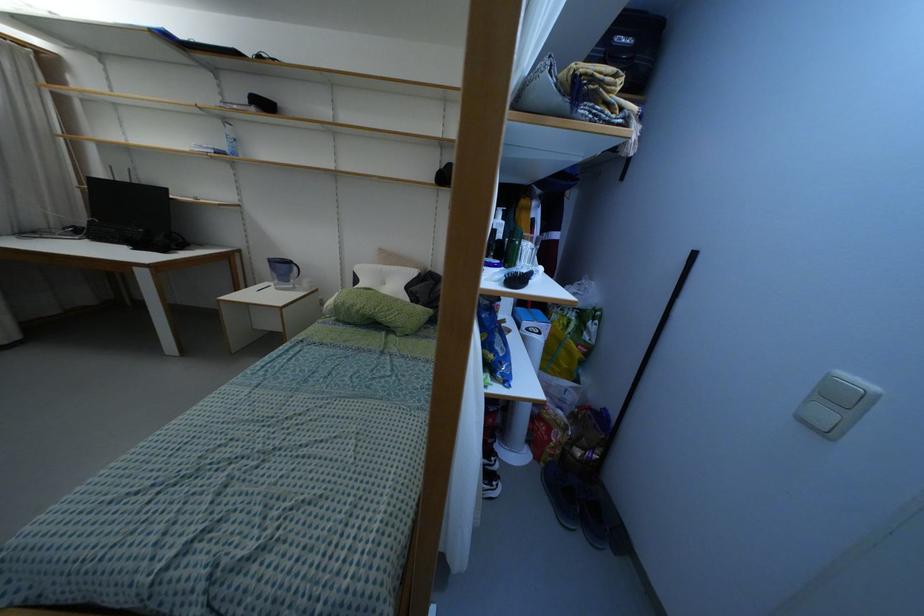
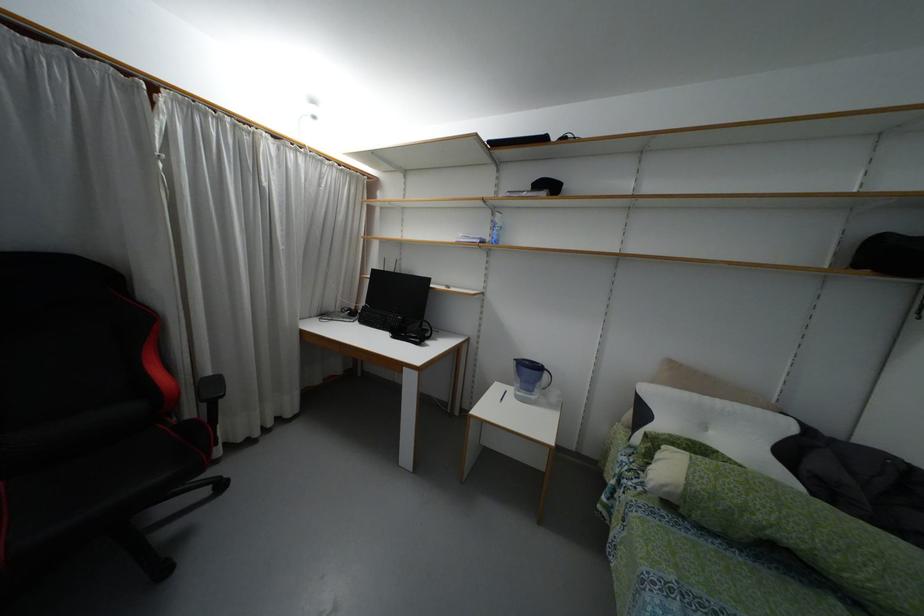
Question: What movement of the cameraman would produce the second image?

Choices:
 (A) Left
 (B) Right
 (C) Forward
 (D) Backward

Answer: (A)